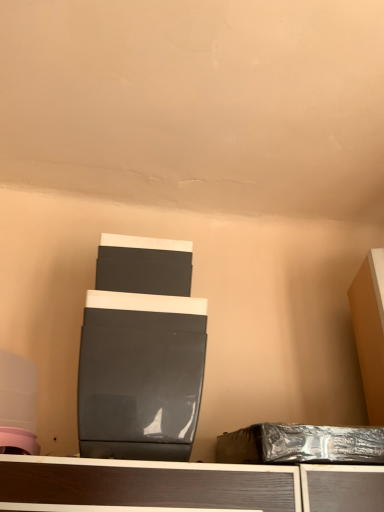
Question: Is shiny metallic box at lower right next to glossy black speaker at center?

Choices:
 (A) yes
 (B) no

Answer: (B)

Question: Could you tell me if shiny metallic box at lower right is turned towards glossy black speaker at center?

Choices:
 (A) no
 (B) yes

Answer: (A)

Question: Considering the relative sizes of shiny metallic box at lower right and glossy black speaker at center in the image provided, is shiny metallic box at lower right smaller than glossy black speaker at center?

Choices:
 (A) yes
 (B) no

Answer: (A)

Question: Is shiny metallic box at lower right positioned before glossy black speaker at center?

Choices:
 (A) yes
 (B) no

Answer: (B)

Question: Is shiny metallic box at lower right to the left of glossy black speaker at center from the viewer's perspective?

Choices:
 (A) no
 (B) yes

Answer: (A)

Question: From a real-world perspective, is shiny metallic box at lower right located higher than glossy black speaker at center?

Choices:
 (A) yes
 (B) no

Answer: (B)

Question: Is matte orange cabinet at right bigger than glossy black speaker at center?

Choices:
 (A) yes
 (B) no

Answer: (B)

Question: Is glossy black speaker at center located within matte orange cabinet at right?

Choices:
 (A) no
 (B) yes

Answer: (A)

Question: Does matte orange cabinet at right come behind glossy black speaker at center?

Choices:
 (A) yes
 (B) no

Answer: (A)

Question: From a real-world perspective, is matte orange cabinet at right on glossy black speaker at center?

Choices:
 (A) yes
 (B) no

Answer: (A)

Question: Does matte orange cabinet at right turn towards glossy black speaker at center?

Choices:
 (A) no
 (B) yes

Answer: (A)

Question: Considering the relative sizes of matte orange cabinet at right and glossy black speaker at center in the image provided, is matte orange cabinet at right thinner than glossy black speaker at center?

Choices:
 (A) yes
 (B) no

Answer: (A)

Question: Does glossy black speaker at center have a greater width compared to matte orange cabinet at right?

Choices:
 (A) no
 (B) yes

Answer: (B)